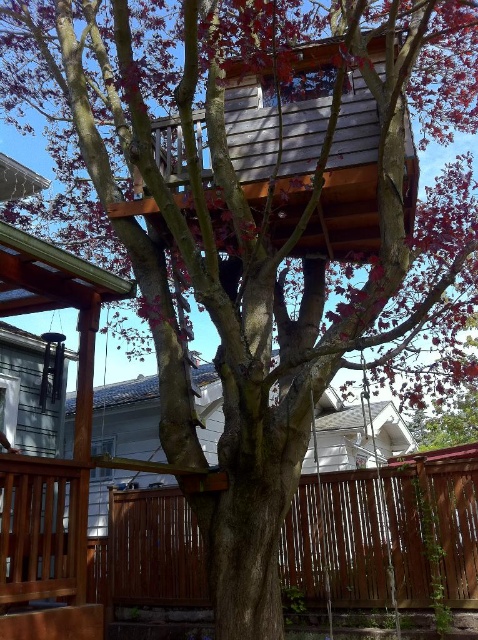
Question: Among these objects, which one is farthest from the camera?

Choices:
 (A) wooden swing at lower right
 (B) brown wooden porch at lower left

Answer: (B)

Question: Which object appears farthest from the camera in this image?

Choices:
 (A) wooden swing at lower right
 (B) brown wooden porch at lower left

Answer: (B)

Question: Does brown wooden porch at lower left have a larger size compared to wooden swing at lower right?

Choices:
 (A) no
 (B) yes

Answer: (B)

Question: Is brown wooden porch at lower left to the right of wooden swing at lower right from the viewer's perspective?

Choices:
 (A) no
 (B) yes

Answer: (B)

Question: Does brown wooden porch at lower left lie behind wooden swing at lower right?

Choices:
 (A) no
 (B) yes

Answer: (B)